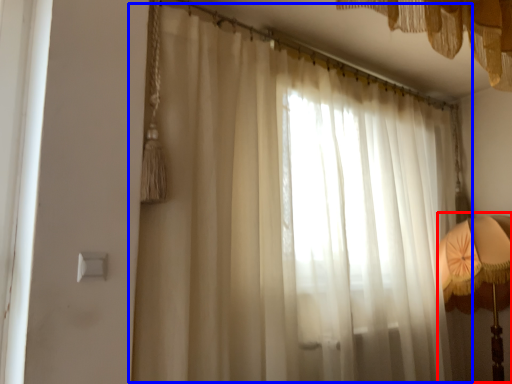
Question: Which object is closer to the camera taking this photo, bedside lamp (highlighted by a red box) or curtain (highlighted by a blue box)?

Choices:
 (A) bedside lamp
 (B) curtain

Answer: (B)